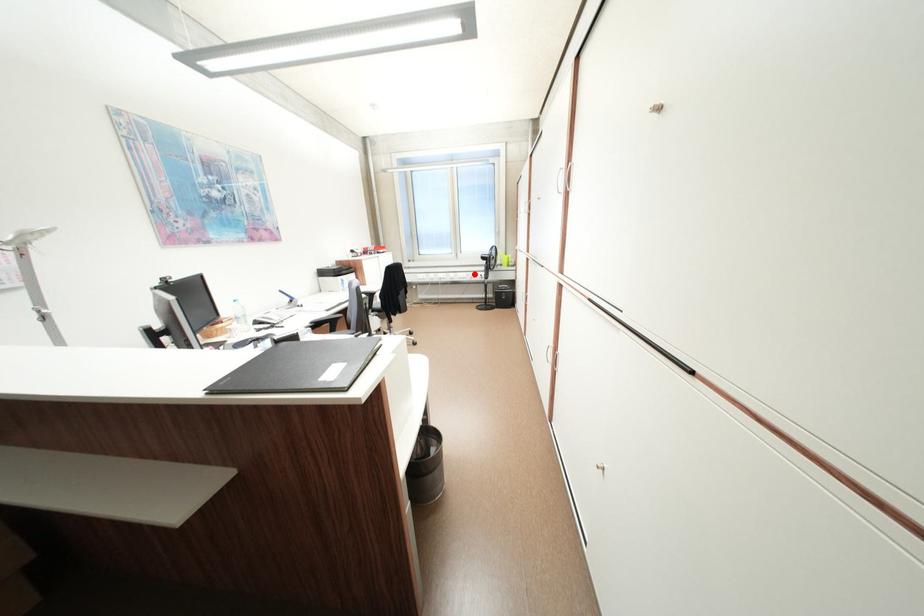
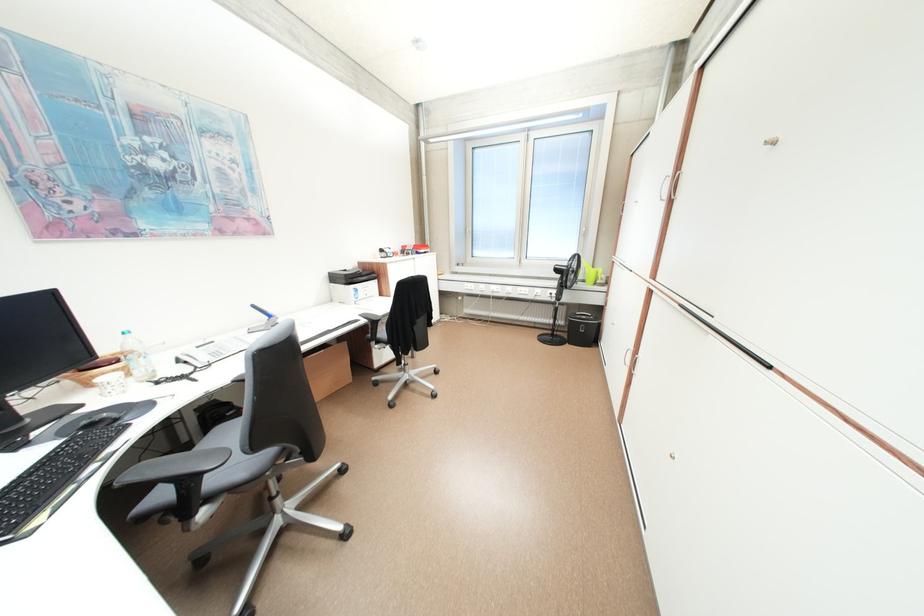
Question: I am providing you with two images of the same scene from different viewpoints. Image1 has a red point marked. In image2, the corresponding 3D location appears at what relative position? Reply with the corresponding letter.

Choices:
 (A) Closer
 (B) Farther

Answer: (B)